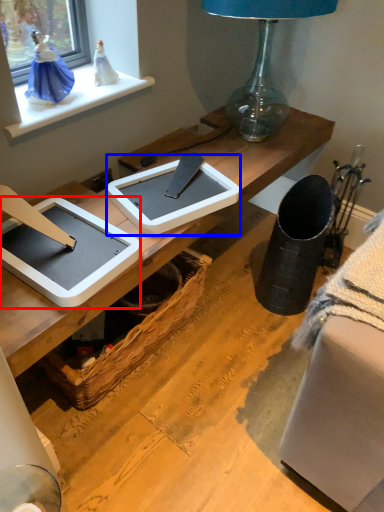
Question: Which of the following is the farthest to the observer, tablet computer (highlighted by a red box) or tablet computer (highlighted by a blue box)?

Choices:
 (A) tablet computer
 (B) tablet computer

Answer: (B)